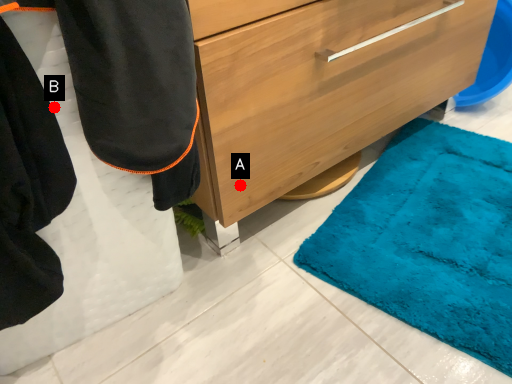
Question: Two points are circled on the image, labeled by A and B beside each circle. Which point is closer to the camera taking this photo?

Choices:
 (A) A is closer
 (B) B is closer

Answer: (B)